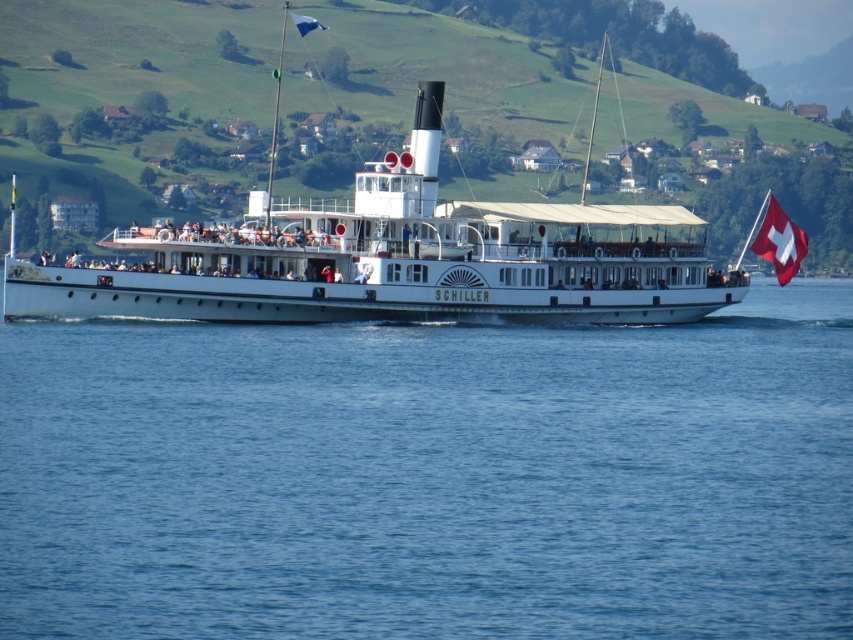
You are standing on the upper deck of the Schiller paddle boat and looking out. Where is the blue water at center relative to your position?

The blue water at center is located at point 0.747 on the x axis and 0.506 on the y axis relative to your position on the upper deck of the Schiller paddle boat.

You are standing on the dock and see the white matte steamboat at center and the swiss flag at right. Which object is closer to your left side?

The white matte steamboat at center is to the left of the swiss flag at right, so it is closer to your left side.

You are a passenger on the white matte steamboat at center. You want to throw a lifebuoy to someone in the water who is 86.90 meters away. Can you reach them with a single throw?

The distance between the white matte steamboat at center and the person in the water is 86.90 meters. A typical lifebuoy throw has a range of about 20 meters, so you cannot reach them with a single throw.